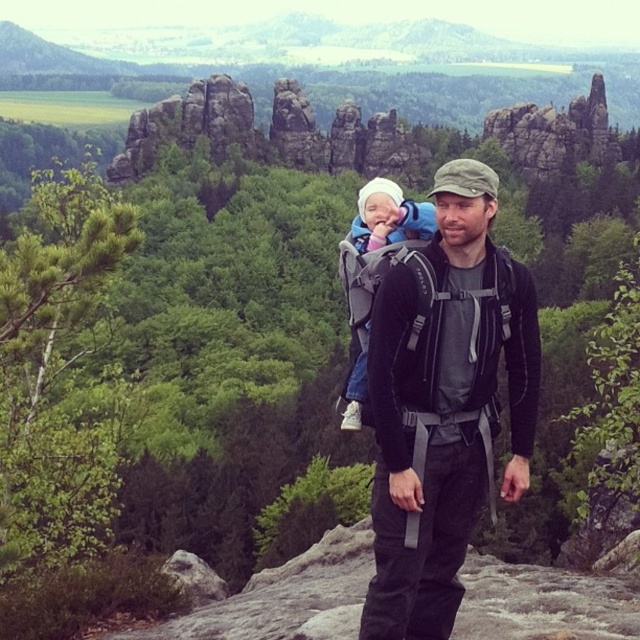
You are a photographer trying to capture a clear shot of both the black fabric backpack at center and the white fleece baby carrier at center. Since they are both at center, which one will appear larger in your photo?

The black fabric backpack at center will appear larger in the photo because it is closer to the viewer than the white fleece baby carrier at center.

You are a photographer trying to capture a photo of the white fleece baby at center and the black fabric backpack at center. Since you want the baby to be the main focus, where should you position the backpack relative to the baby in your shot?

The black fabric backpack at center is already positioned to the right of the white fleece baby at center, so to keep the baby as the main focus, you should ensure the backpack remains to the right side in the shot.